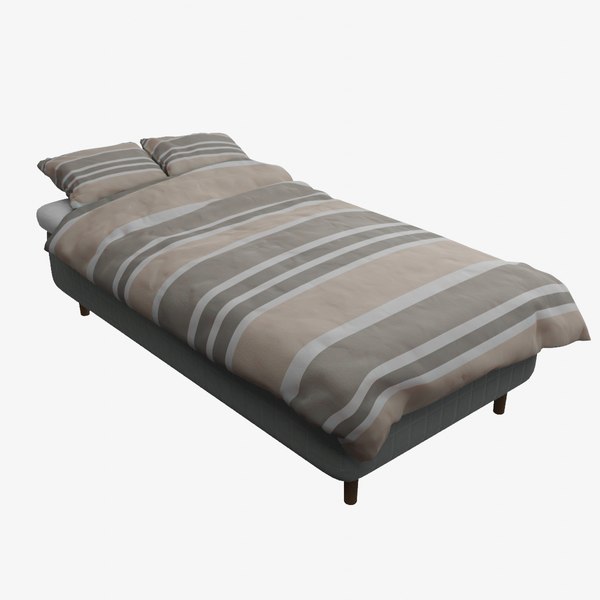
This screenshot has width=600, height=600. Find the location of `sheet`. sheet is located at coordinates (56, 208).